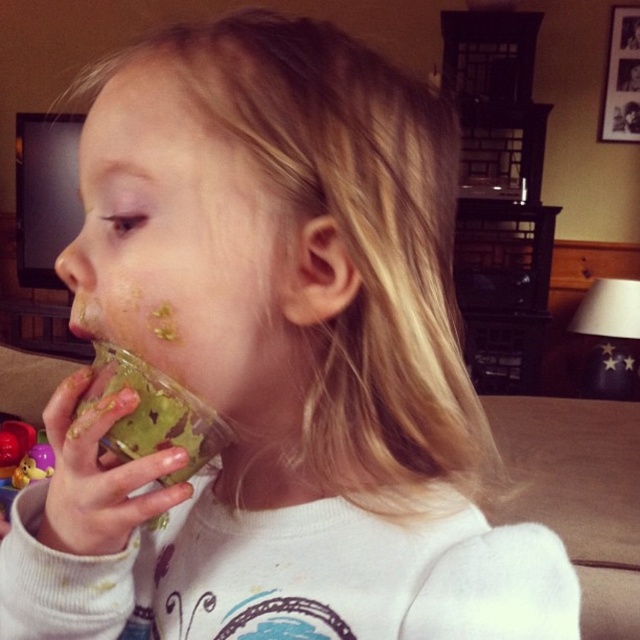
Is point (120, 376) positioned in front of point (12, 429)?

Yes.

Is point (209, 452) farther from camera compared to point (12, 433)?

No, (209, 452) is closer to viewer.

Image resolution: width=640 pixels, height=640 pixels. Identify the location of green leafy drink at mouth. (152, 413).